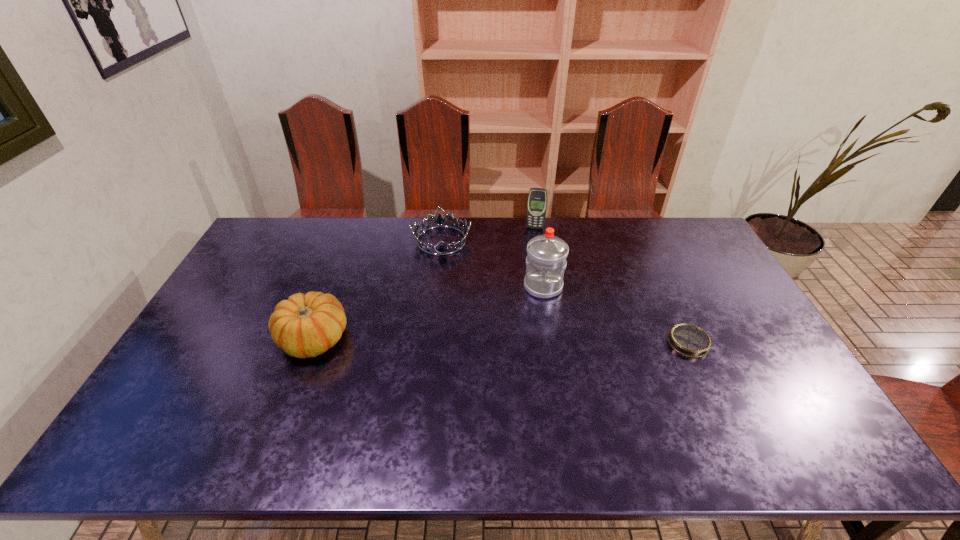
Locate an element on the screen. This screenshot has height=540, width=960. cellular telephone that is at the far edge is located at coordinates (537, 199).

Identify the location of tiara that is at the far edge. (439, 221).

This screenshot has height=540, width=960. In the image, there is a desktop. What are the coordinates of `vacant space at the far edge` in the screenshot? It's located at pyautogui.click(x=371, y=252).

Identify the location of vacant area at the left edge. (199, 346).

Locate an element on the screen. This screenshot has height=540, width=960. free space at the right edge is located at coordinates (741, 303).

This screenshot has width=960, height=540. I want to click on vacant space at the far left corner, so click(x=275, y=219).

I want to click on vacant space at the far right corner, so click(x=672, y=255).

Identify the location of free spot at the near right corner of the desktop. (747, 397).

Find the location of a particular element. Image resolution: width=960 pixels, height=540 pixels. free space between the leftmost object and the fourth object from right to left is located at coordinates (377, 289).

Locate an element on the screen. unoccupied position between the compass and the gourd is located at coordinates (501, 340).